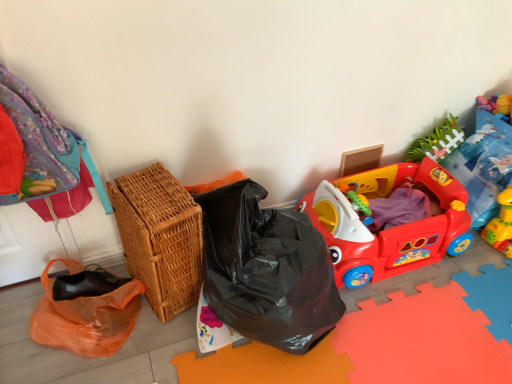
Question: Is woven brown basket at left smaller than matte cardboard box at upper right?

Choices:
 (A) no
 (B) yes

Answer: (A)

Question: Is woven brown basket at left at the left side of matte cardboard box at upper right?

Choices:
 (A) no
 (B) yes

Answer: (B)

Question: From the image's perspective, is woven brown basket at left under matte cardboard box at upper right?

Choices:
 (A) yes
 (B) no

Answer: (A)

Question: Could you tell me if woven brown basket at left is facing matte cardboard box at upper right?

Choices:
 (A) yes
 (B) no

Answer: (B)

Question: From a real-world perspective, is woven brown basket at left positioned under matte cardboard box at upper right based on gravity?

Choices:
 (A) yes
 (B) no

Answer: (B)

Question: Is point (502, 193) positioned closer to the camera than point (376, 150)?

Choices:
 (A) closer
 (B) farther

Answer: (A)

Question: In the image, is yellow rubber duck at lower right, the 2th toy from the left, on the left side or the right side of matte cardboard box at upper right?

Choices:
 (A) left
 (B) right

Answer: (B)

Question: Looking at their shapes, would you say yellow rubber duck at lower right, arranged as the first toy when viewed from the right, is wider or thinner than matte cardboard box at upper right?

Choices:
 (A) wide
 (B) thin

Answer: (A)

Question: Is yellow rubber duck at lower right, arranged as the first toy when viewed from the right, spatially inside matte cardboard box at upper right, or outside of it?

Choices:
 (A) outside
 (B) inside

Answer: (A)

Question: Does point (378, 150) appear closer or farther from the camera than point (462, 200)?

Choices:
 (A) farther
 (B) closer

Answer: (A)

Question: In the image, is matte cardboard box at upper right positioned in front of or behind rubberized plastic play car at right, which is the second toy from right to left?

Choices:
 (A) behind
 (B) front

Answer: (A)

Question: Is matte cardboard box at upper right wider or thinner than rubberized plastic play car at right, the first toy when ordered from left to right?

Choices:
 (A) thin
 (B) wide

Answer: (A)

Question: From a real-world perspective, is matte cardboard box at upper right above or below rubberized plastic play car at right, the first toy when ordered from left to right?

Choices:
 (A) below
 (B) above

Answer: (B)

Question: In terms of height, does rubberized plastic play car at right, the first toy when ordered from left to right, look taller or shorter compared to woven brown basket at left?

Choices:
 (A) short
 (B) tall

Answer: (A)

Question: Considering the positions of rubberized plastic play car at right, which is the second toy from right to left, and woven brown basket at left in the image, is rubberized plastic play car at right, which is the second toy from right to left, bigger or smaller than woven brown basket at left?

Choices:
 (A) small
 (B) big

Answer: (B)